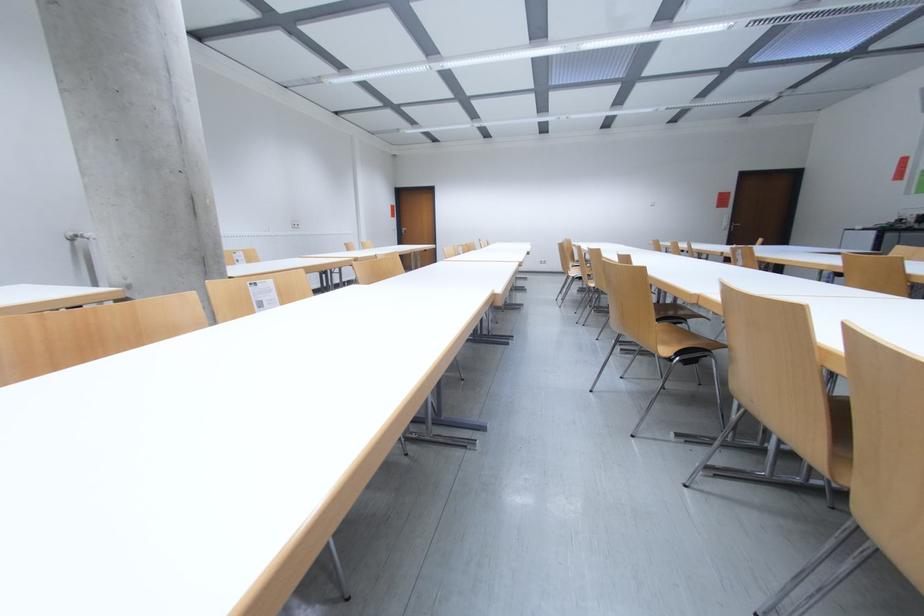
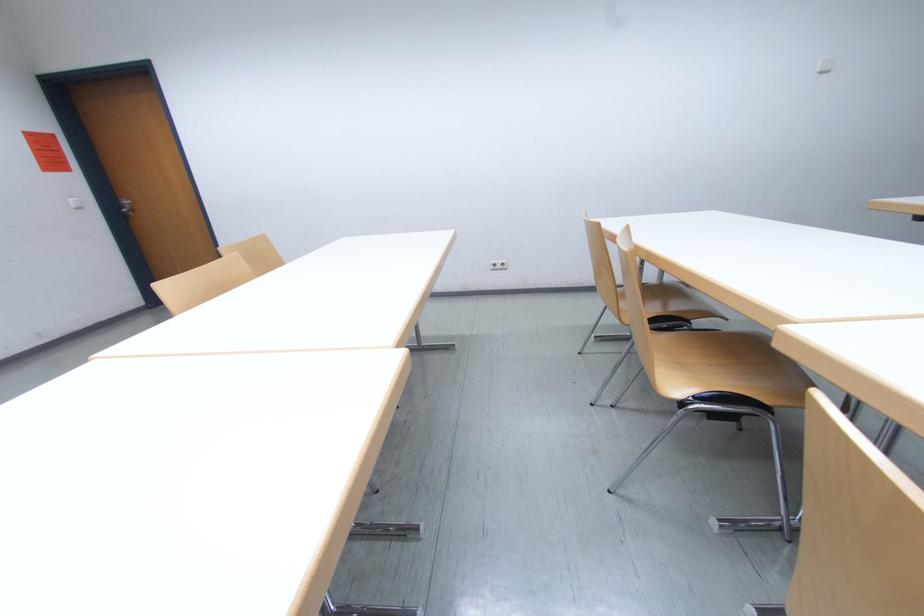
The point at (551, 262) is marked in the first image. Where is the corresponding point in the second image?

(505, 265)